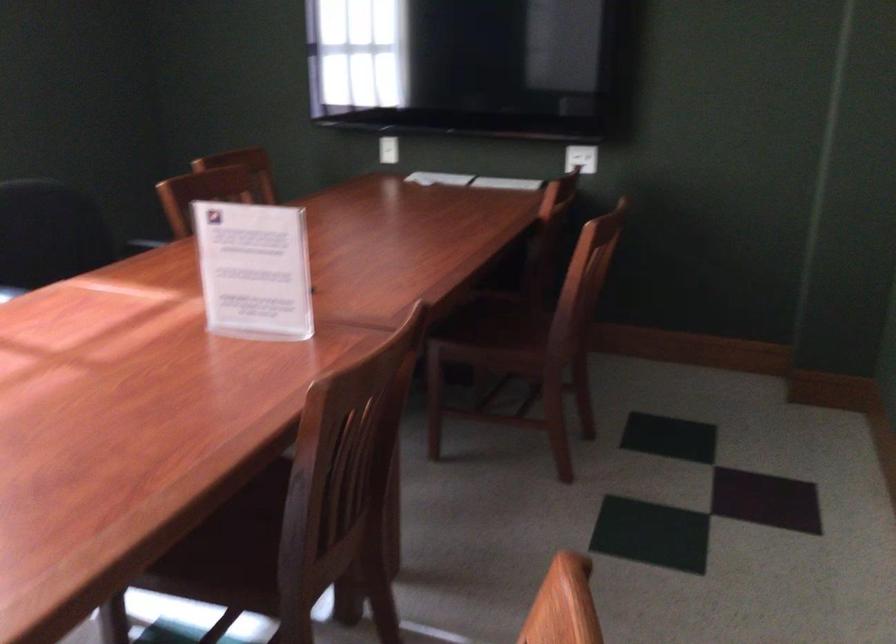
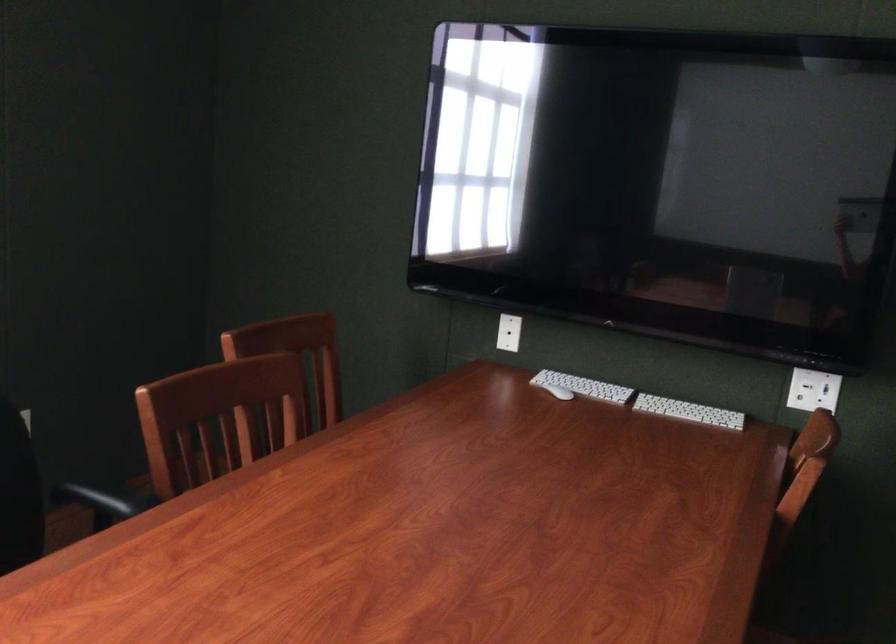
The point at (509, 180) is marked in the first image. Where is the corresponding point in the second image?

(688, 412)